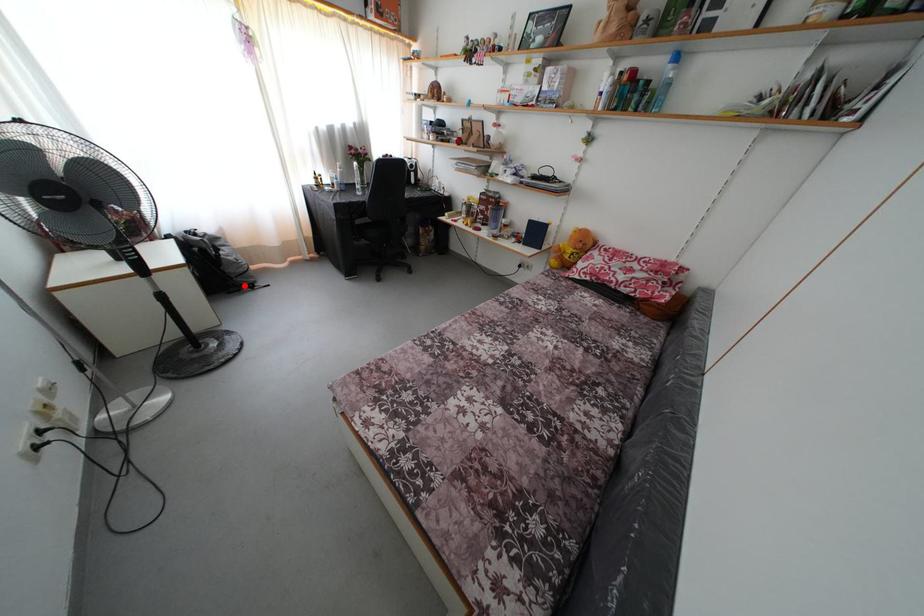
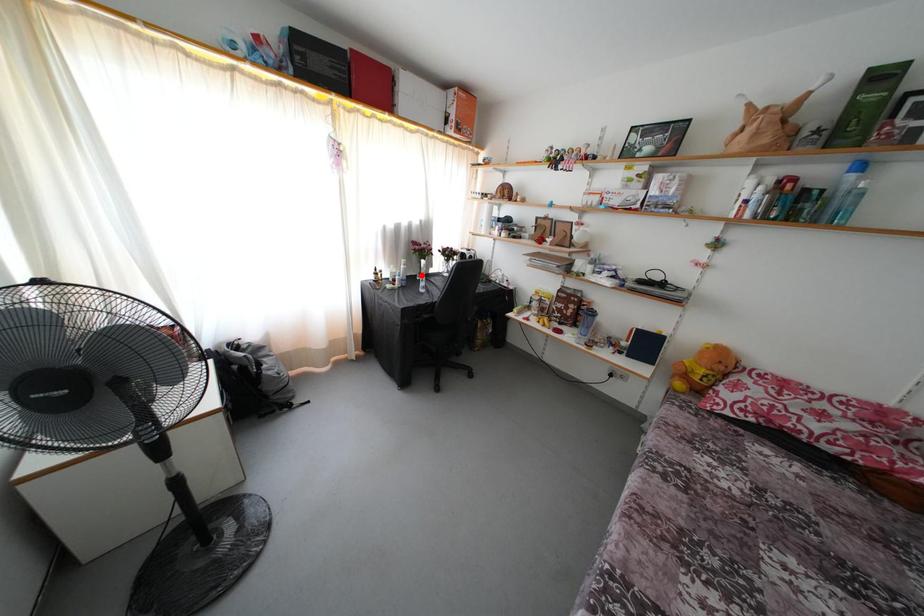
I am providing you with two images of the same scene from different viewpoints. A red point is marked on the first image and another point is marked on the second image. Does the point marked in image1 correspond to the same location as the one in image2?

No